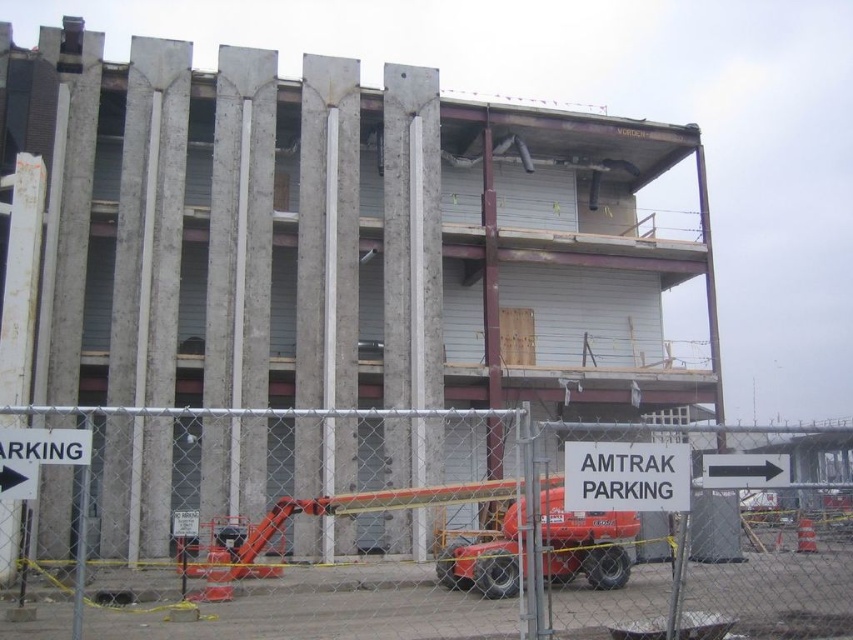
You are a construction worker who needs to move a 10 meter long steel beam from the orange rubber lift at lower center to the location pointed by the black arrow at right. Can you safely transport the beam without extending it beyond the available space?

The orange rubber lift at lower center is 8.45 meters from the black arrow at right. Since the steel beam is 10 meters long, it would extend 1.55 meters beyond the distance between them, making it unsafe to transport without proper clearance. Adjust the route or shorten the beam to fit within the 8.45 meter space.